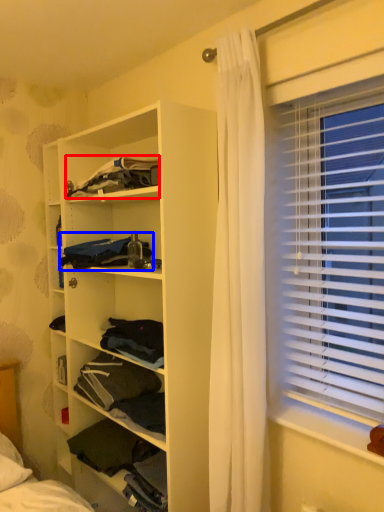
Question: Which object is closer to the camera taking this photo, clothing (highlighted by a red box) or clothing (highlighted by a blue box)?

Choices:
 (A) clothing
 (B) clothing

Answer: (A)